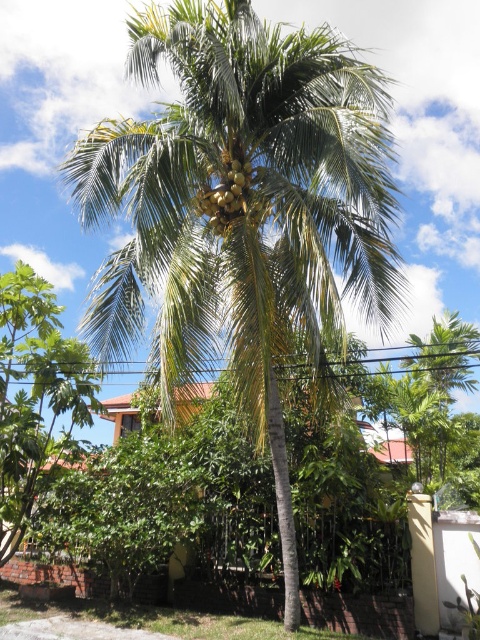
Question: Does green leafy coconut tree at center have a greater width compared to green matte coconut at center?

Choices:
 (A) yes
 (B) no

Answer: (B)

Question: Which of the following is the closest to the observer?

Choices:
 (A) (233, 173)
 (B) (278, 177)

Answer: (B)

Question: Which point is farther to the camera?

Choices:
 (A) (357, 120)
 (B) (247, 179)

Answer: (B)

Question: Is green leafy coconut tree at center to the right of green matte coconut at center from the viewer's perspective?

Choices:
 (A) no
 (B) yes

Answer: (A)

Question: Considering the relative positions of green leafy coconut tree at center and green matte coconut at center in the image provided, where is green leafy coconut tree at center located with respect to green matte coconut at center?

Choices:
 (A) below
 (B) above

Answer: (A)